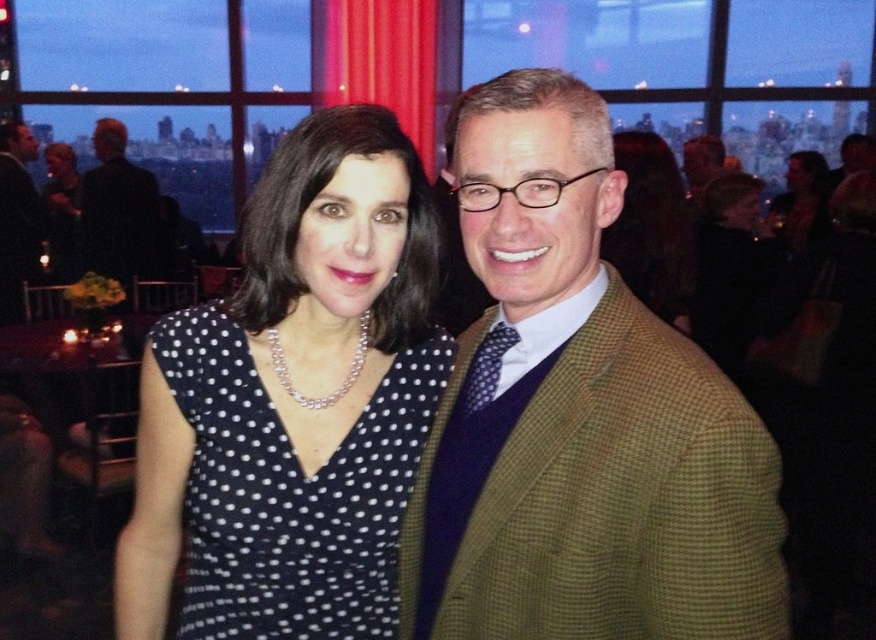
You are standing in front of the image and want to describe the position of the green checkered blazer at right. What are its coordinates?

The green checkered blazer at right is located at coordinates point (578, 419).

You are a photographer trying to ensure that both the green checkered blazer at right and the black dotted fabric dress at center are visible in the photo. Based on their positions, which one is higher up in the frame?

The green checkered blazer at right is located above the black dotted fabric dress at center, so it is higher up in the frame.

You are a photographer standing 1 meter away from the green checkered blazer at right. Can you comfortably adjust the camera settings without moving closer? Please explain your reasoning.

The photographer is 1 meter away from the green checkered blazer at right. Since the distance is 100 centimeters, which is greater than the 84.70 centimeters mentioned, the photographer can comfortably adjust the camera settings without needing to move closer.